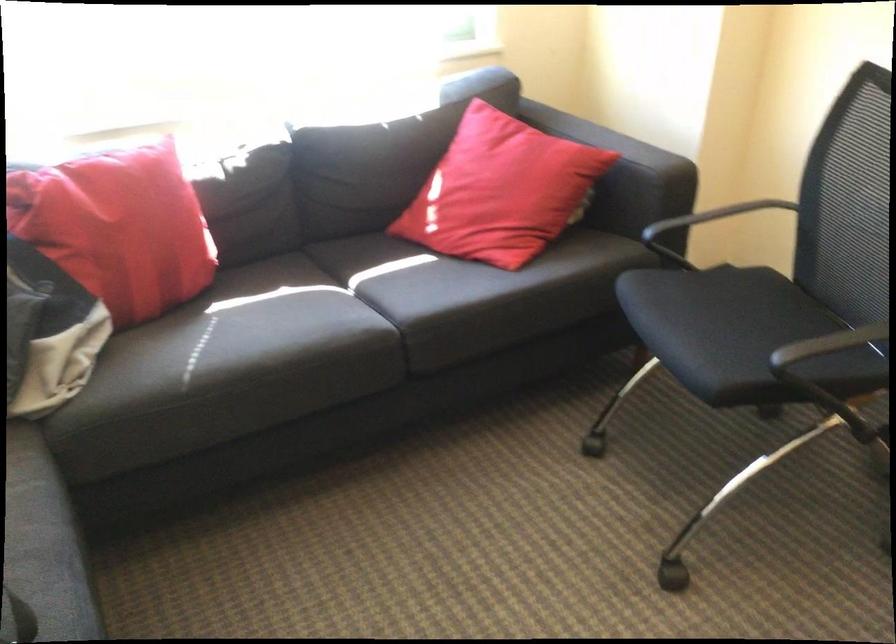
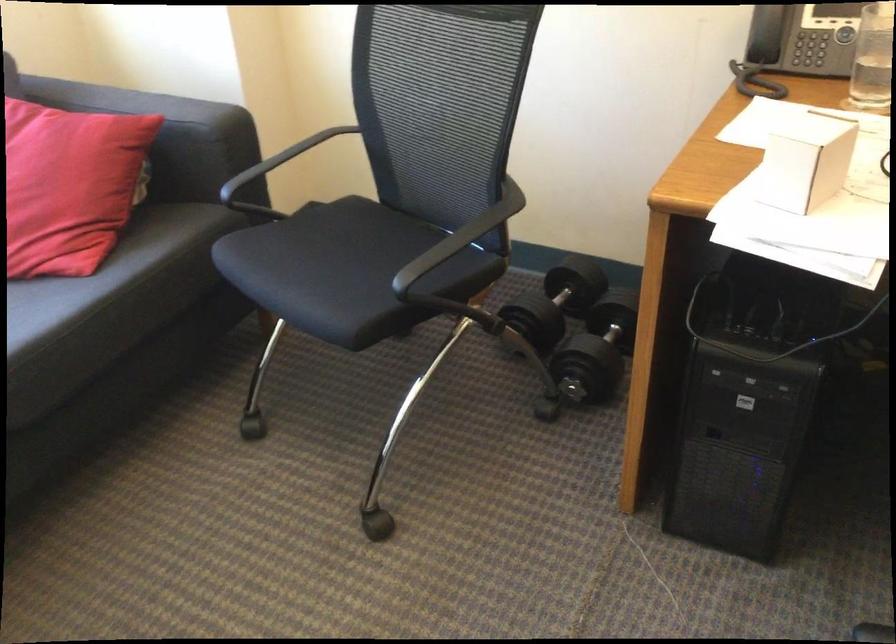
The point at (524,191) is marked in the first image. Where is the corresponding point in the second image?

(69, 185)